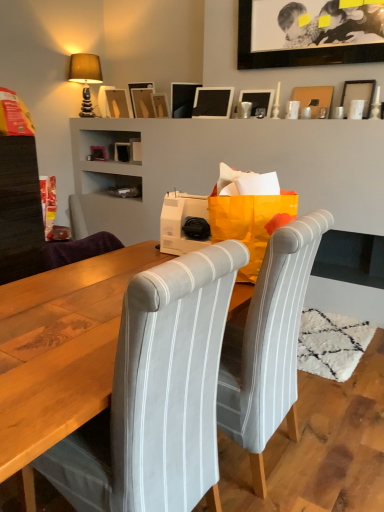
Question: From a real-world perspective, is matte black picture frame at upper center, which is the 5th picture frame from right to left, over wooden picture frame at upper center, marked as the third picture frame in a left-to-right arrangement?

Choices:
 (A) no
 (B) yes

Answer: (B)

Question: Is the position of matte black picture frame at upper center, which is the 5th picture frame from right to left, less distant than that of wooden picture frame at upper center, the seventh picture frame when ordered from right to left?

Choices:
 (A) yes
 (B) no

Answer: (A)

Question: Is matte black picture frame at upper center, which is the 5th picture frame from right to left, turned away from wooden picture frame at upper center, the seventh picture frame when ordered from right to left?

Choices:
 (A) yes
 (B) no

Answer: (B)

Question: Does matte black picture frame at upper center, acting as the 5th picture frame starting from the left, have a lesser height compared to wooden picture frame at upper center, marked as the third picture frame in a left-to-right arrangement?

Choices:
 (A) yes
 (B) no

Answer: (B)

Question: Does matte black picture frame at upper center, which is the 5th picture frame from right to left, appear on the right side of wooden picture frame at upper center, marked as the third picture frame in a left-to-right arrangement?

Choices:
 (A) no
 (B) yes

Answer: (B)

Question: Looking at their shapes, would you say matte black picture frame at upper center, the 4th picture frame in the left-to-right sequence, is wider or thinner than matte brown fabric lampshade at upper left?

Choices:
 (A) wide
 (B) thin

Answer: (B)

Question: Based on their positions, is matte black picture frame at upper center, the sixth picture frame positioned from the right, located to the left or right of matte brown fabric lampshade at upper left?

Choices:
 (A) right
 (B) left

Answer: (A)

Question: Relative to matte brown fabric lampshade at upper left, is matte black picture frame at upper center, the sixth picture frame positioned from the right, in front or behind?

Choices:
 (A) behind
 (B) front

Answer: (B)

Question: From the image's perspective, relative to matte brown fabric lampshade at upper left, is matte black picture frame at upper center, the sixth picture frame positioned from the right, above or below?

Choices:
 (A) above
 (B) below

Answer: (B)

Question: Is matte brown fabric lampshade at upper left inside or outside of white striped fabric chair at center, marked as the 2th chair in a left-to-right arrangement?

Choices:
 (A) outside
 (B) inside

Answer: (A)

Question: Considering the positions of point (94, 115) and point (269, 314), is point (94, 115) closer or farther from the camera than point (269, 314)?

Choices:
 (A) farther
 (B) closer

Answer: (A)

Question: From a real-world perspective, is matte brown fabric lampshade at upper left positioned above or below white striped fabric chair at center, placed as the first chair when sorted from right to left?

Choices:
 (A) above
 (B) below

Answer: (A)

Question: Based on their positions, is matte brown fabric lampshade at upper left located to the left or right of white striped fabric chair at center, marked as the 2th chair in a left-to-right arrangement?

Choices:
 (A) left
 (B) right

Answer: (A)

Question: From the image's perspective, is matte black picture frame at upper right, the ninth picture frame from the left, located above or below black matte picture frame at upper center, which ranks as the 3th picture frame in right-to-left order?

Choices:
 (A) above
 (B) below

Answer: (B)

Question: Is matte black picture frame at upper right, the ninth picture frame from the left, taller or shorter than black matte picture frame at upper center, positioned as the seventh picture frame in left-to-right order?

Choices:
 (A) short
 (B) tall

Answer: (A)